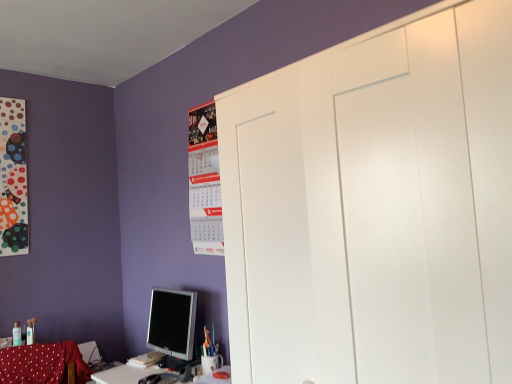
Question: Would you say matte silver monitor at lower left is to the left or to the right of matte paper calendar at upper center in the picture?

Choices:
 (A) left
 (B) right

Answer: (A)

Question: Is matte silver monitor at lower left taller or shorter than matte paper calendar at upper center?

Choices:
 (A) short
 (B) tall

Answer: (A)

Question: Based on their relative distances, which object is nearer to the red fabric swivel chair at lower left?

Choices:
 (A) matte paper calendar at upper center
 (B) matte silver monitor at lower left

Answer: (B)

Question: Which is nearer to the matte paper calendar at upper center?

Choices:
 (A) red fabric swivel chair at lower left
 (B) matte silver monitor at lower left

Answer: (B)